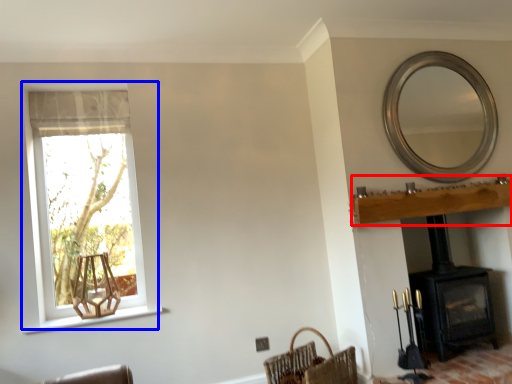
Question: Among these objects, which one is nearest to the camera, mantle (highlighted by a red box) or window (highlighted by a blue box)?

Choices:
 (A) mantle
 (B) window

Answer: (A)